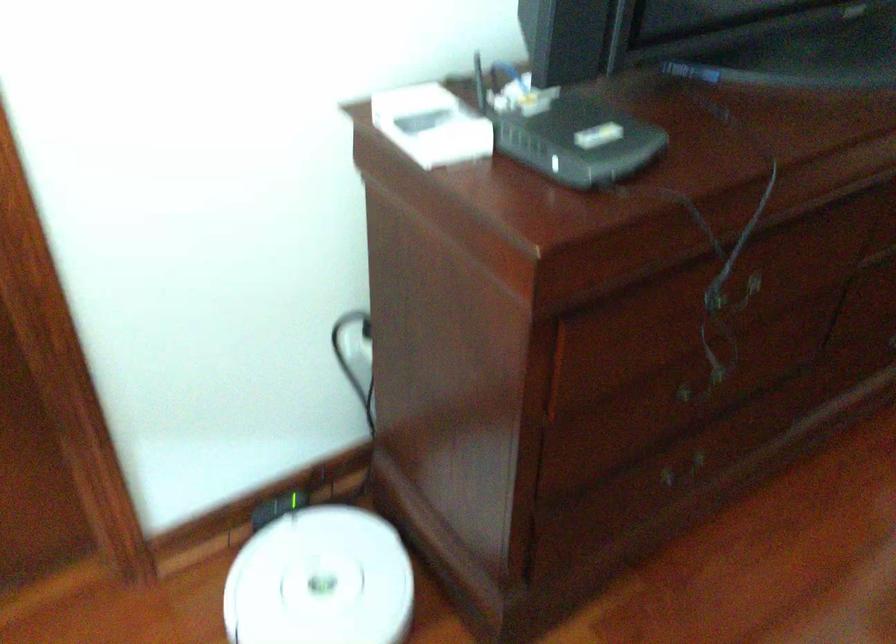
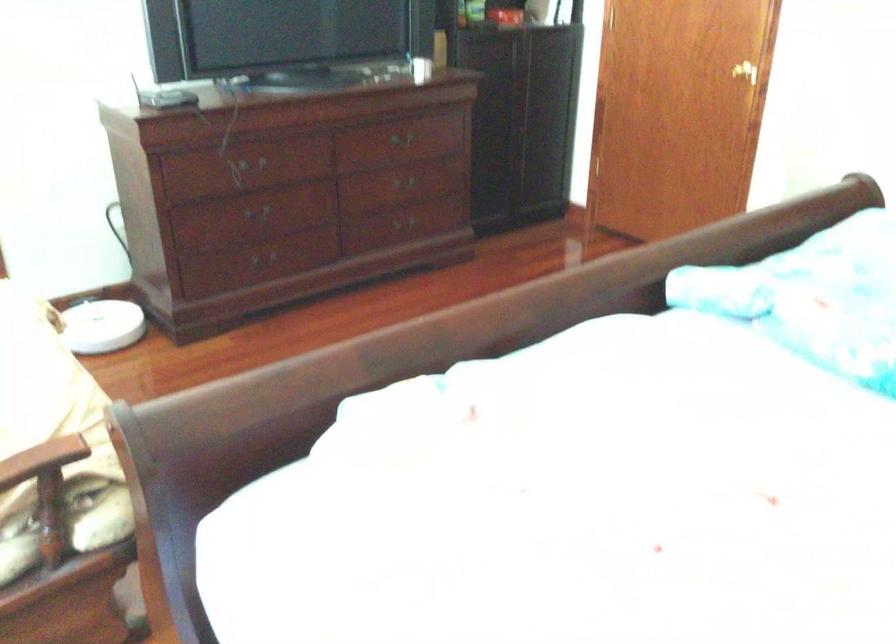
The point at (726,279) is marked in the first image. Where is the corresponding point in the second image?

(255, 164)